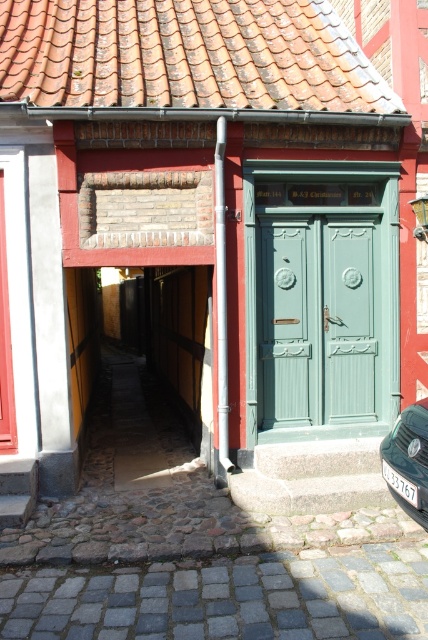
You are a delivery person trying to park your metallic silver car at lower right near the entrance of the building. However, there is a green wooden door at center in the way. Can you park your car close to the door without blocking it?

The green wooden door at center is positioned over the metallic silver car at lower right, which means the door is above the car. Since the door is above, you can park the metallic silver car at lower right close to the entrance without blocking the door as they are vertically aligned.

You are a delivery person with a 10 feet long ladder that needs to be carried through the alleyway between the terracotta clay tiles at upper center and the metallic silver car at lower right. Can you safely pass the ladder through the alleyway without it hitting anything?

The distance between the terracotta clay tiles at upper center and the metallic silver car at lower right is 12.71 feet. Since the ladder is only 10 feet long, it can be safely carried through the alleyway as the available space is wider than the ladder.

You are standing at the entrance of the building and want to park your metallic silver car at lower right as close as possible to the terracotta clay tiles at upper center. Is there enough space between them for the car to maneuver?

The terracotta clay tiles at upper center are to the left of the metallic silver car at lower right, so there is space between them for the car to maneuver.